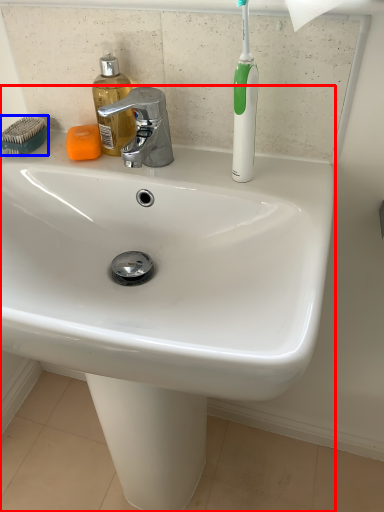
Question: Which of the following is the farthest to the observer, sink (highlighted by a red box) or comb (highlighted by a blue box)?

Choices:
 (A) sink
 (B) comb

Answer: (B)